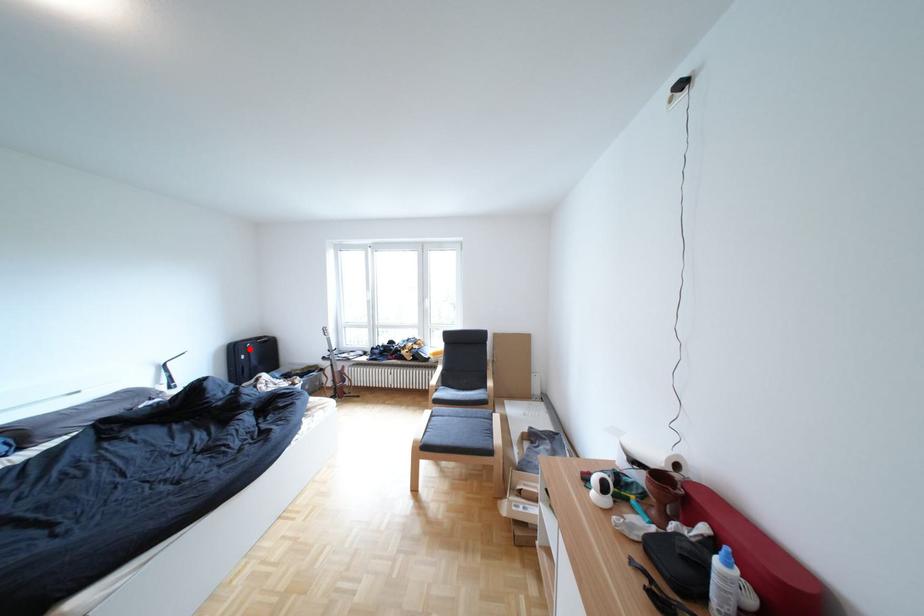
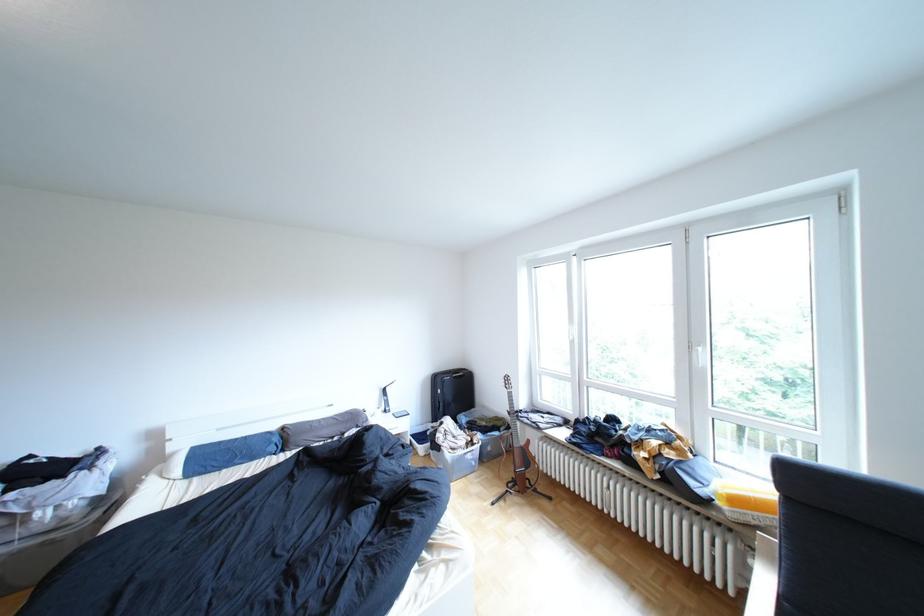
Locate, in the second image, the point that corresponds to the highlighted location in the first image.

(452, 379)